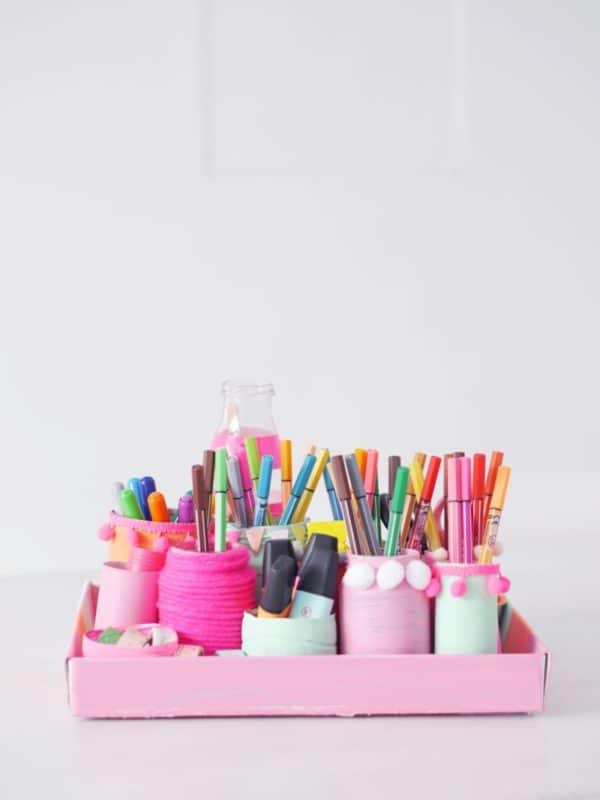
Locate an element on the screen. pink marker is located at coordinates (453, 517), (462, 517), (371, 478), (245, 474), (180, 510).